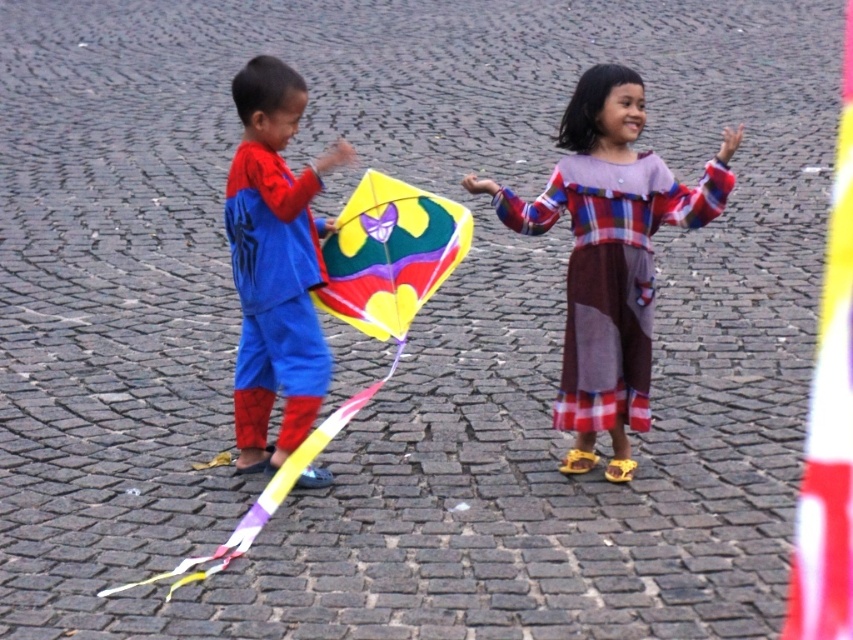
Which object is located at the coordinate point (608,253)?

The point (608,253) is located on the plaid cotton dress at center.

You are standing at the point with coordinates point (x=462, y=236) and want to move to the point with coordinates point (x=299, y=92). Which direction should you face to walk towards your destination?

You should face north because point (x=299, y=92) is in front of point (x=462, y=236).

You are standing in the scene and want to place a small flag at the point closer to you. Which point should you choose between point (614, 429) and point (251, 122)?

You should choose point (614, 429) because it is closer to you than point (251, 122).